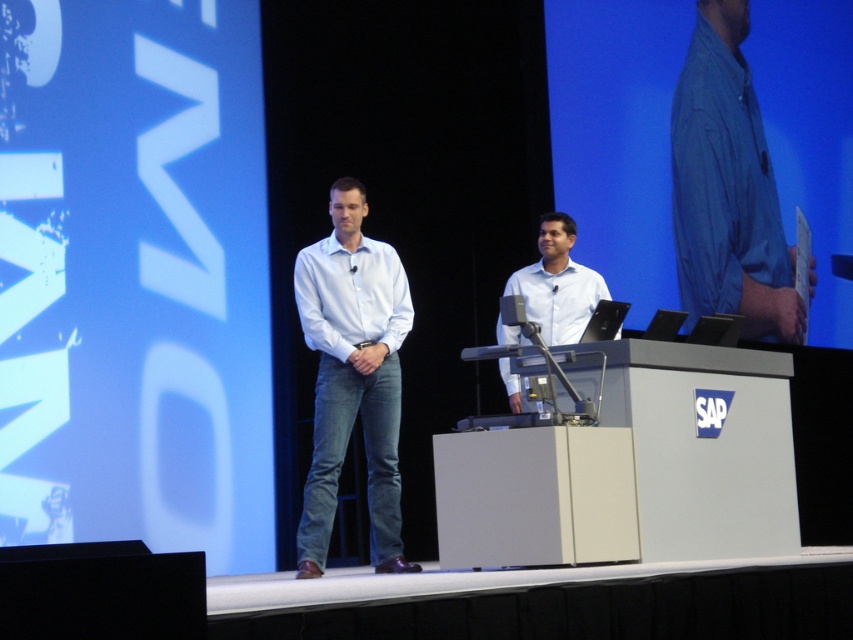
Does blue cotton shirt at upper right appear under white smooth shirt at center?

No, blue cotton shirt at upper right is not below white smooth shirt at center.

Is point (726, 243) positioned in front of point (309, 250)?

No.

You are a GUI agent. You are given a task and a screenshot of the screen. Output one action in this format:
    pyautogui.click(x=<x>, y=<y>)
    Task: Click on the blue cotton shirt at upper right
    The width and height of the screenshot is (853, 640).
    Given the screenshot: What is the action you would take?
    pyautogui.click(x=727, y=188)

Between blue cotton shirt at upper right and white cotton shirt at center, which one appears on the left side from the viewer's perspective?

white cotton shirt at center

Based on the photo, is blue cotton shirt at upper right bigger than white cotton shirt at center?

Yes.

The image size is (853, 640). What are the coordinates of `blue cotton shirt at upper right` in the screenshot? It's located at (727, 188).

I want to click on blue cotton shirt at upper right, so click(x=727, y=188).

Can you confirm if white cotton shirt at center is bigger than white smooth shirt at center?

Correct, white cotton shirt at center is larger in size than white smooth shirt at center.

What are the coordinates of `white cotton shirt at center` in the screenshot? It's located at (352, 376).

Who is more distant from viewer, (300, 276) or (317, 339)?

The point (300, 276) is more distant.

Locate an element on the screen. white cotton shirt at center is located at coordinates (352, 376).